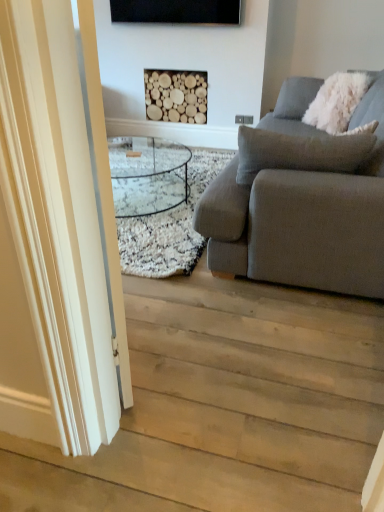
Question: Looking at the image, does white fluffy pillow at upper right seem bigger or smaller compared to light wood floor at lower left?

Choices:
 (A) big
 (B) small

Answer: (B)

Question: Considering the positions of point (360, 96) and point (317, 352), is point (360, 96) closer or farther from the camera than point (317, 352)?

Choices:
 (A) closer
 (B) farther

Answer: (B)

Question: Considering the real-world distances, which object is closest to the natural wood logs at upper center?

Choices:
 (A) gray fabric couch at right
 (B) light wood floor at lower left
 (C) white glossy door at left
 (D) white fluffy pillow at upper right

Answer: (D)

Question: Which is nearer to the white glossy door at left?

Choices:
 (A) natural wood logs at upper center
 (B) gray fabric couch at right
 (C) white fluffy pillow at upper right
 (D) light wood floor at lower left

Answer: (D)